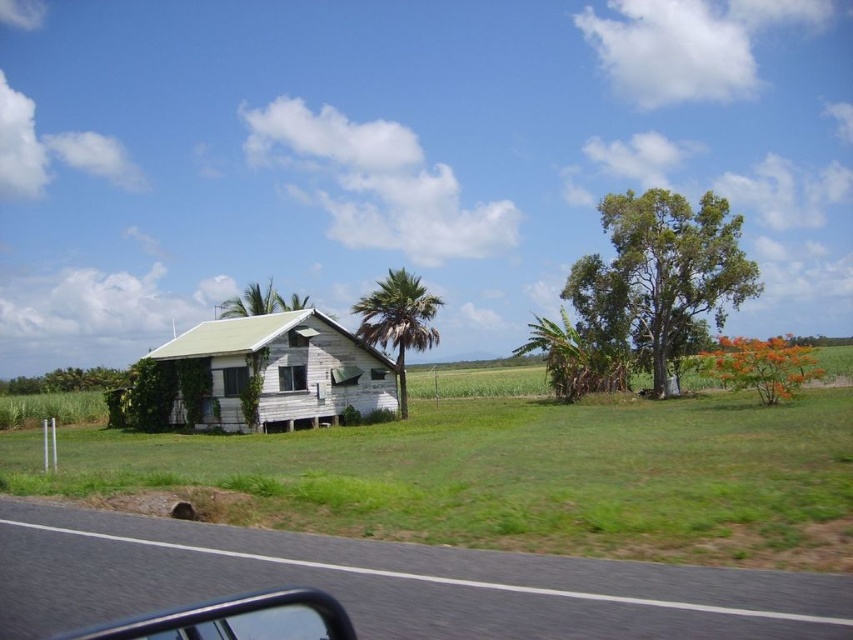
You are driving a car with a 2.5 meter wide trunk and you want to park your car so that the trunk faces the transparent glass car window at lower left. The green leafy tree at upper right is in the way. Can you park your car without hitting the tree?

The distance between the green leafy tree at upper right and the transparent glass car window at lower left is 24.40 meters. Since the trunk of the car is only 2.5 meters wide, you can park the car by positioning it so that the trunk faces the transparent glass car window at lower left while maintaining enough space to avoid the tree, as 24.40 meters is significantly larger than 2.5 meters.

You are a delivery driver who needs to park your truck near the weathered wood house at left without blocking the black asphalt road at lower left. Given that your truck is 10 meters long, can you safely park your truck along the path between them?

The distance between the weathered wood house at left and the black asphalt road at lower left is 12.17 meters. Since the truck is 10 meters long, there is sufficient space to park it without blocking the road as the distance is greater than the truck length.

You are a delivery drone flying at an altitude of 5 meters. You need to deliver a package to the weathered wood house at left. There is a black asphalt road at lower left in your path. Can you safely fly over the road without hitting any obstacles?

The weathered wood house at left has a greater height compared to the black asphalt road at lower left. Since the drone is flying at 5 meters, it can safely pass over the road as the house is taller, but the road is lower, so no obstacles would block the path.